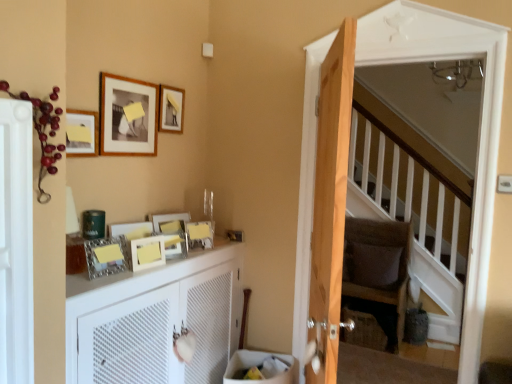
This screenshot has height=384, width=512. Describe the element at coordinates (330, 202) in the screenshot. I see `light brown wooden door at center` at that location.

From the picture: What is the approximate width of wooden photo frame at upper center, which is the first picture frame from top to bottom?

The width of wooden photo frame at upper center, which is the first picture frame from top to bottom, is 2.28 inches.

The image size is (512, 384). Describe the element at coordinates (480, 125) in the screenshot. I see `wooden screen door at right, the 2th screen door from the left` at that location.

What do you see at coordinates (104, 257) in the screenshot? I see `matte silver picture frame at center, the 2th picture frame in the bottom-to-top sequence` at bounding box center [104, 257].

This screenshot has width=512, height=384. Identify the location of light brown wooden door at center. (330, 202).

Where is `the 7th picture frame to the left of the dark brown fabric armchair at center, counting from the anchor's position`? The height and width of the screenshot is (384, 512). the 7th picture frame to the left of the dark brown fabric armchair at center, counting from the anchor's position is located at coordinates (104, 257).

From the image's perspective, which is below, dark brown fabric armchair at center or matte silver picture frame at center, the 2th picture frame in the bottom-to-top sequence?

From the image's view, dark brown fabric armchair at center is below.

Considering the relative positions of dark brown fabric armchair at center and matte silver picture frame at center, which ranks as the seventh picture frame in top-to-bottom order, in the image provided, is dark brown fabric armchair at center in front of matte silver picture frame at center, which ranks as the seventh picture frame in top-to-bottom order,?

No, dark brown fabric armchair at center is further to the viewer.

Is dark brown fabric armchair at center placed right next to matte silver picture frame at center, which ranks as the seventh picture frame in top-to-bottom order?

No, dark brown fabric armchair at center is not next to matte silver picture frame at center, which ranks as the seventh picture frame in top-to-bottom order.

Is metallic silver picture frame at upper center, the 4th picture frame when ordered from bottom to top, at the back of matte wooden picture frame at upper left, which appears as the 7th picture frame when ordered from the bottom?

No, matte wooden picture frame at upper left, which appears as the 7th picture frame when ordered from the bottom,'s orientation is not away from metallic silver picture frame at upper center, the 4th picture frame when ordered from bottom to top.

Is matte wooden picture frame at upper left, which appears as the 7th picture frame when ordered from the bottom, taller or shorter than metallic silver picture frame at upper center, which is the fifth picture frame from top to bottom?

Clearly, matte wooden picture frame at upper left, which appears as the 7th picture frame when ordered from the bottom, is taller compared to metallic silver picture frame at upper center, which is the fifth picture frame from top to bottom.

Considering the sizes of objects matte wooden picture frame at upper left, which appears as the 7th picture frame when ordered from the bottom, and metallic silver picture frame at upper center, the 4th picture frame when ordered from bottom to top, in the image provided, who is thinner, matte wooden picture frame at upper left, which appears as the 7th picture frame when ordered from the bottom, or metallic silver picture frame at upper center, the 4th picture frame when ordered from bottom to top,?

matte wooden picture frame at upper left, which appears as the 7th picture frame when ordered from the bottom.

From the image's perspective, between matte wooden picture frame at upper center, the 4th picture frame positioned from the top, and white matte cabinet at left, who is located below?

white matte cabinet at left appears lower in the image.

How many degrees apart are the facing directions of matte wooden picture frame at upper center, acting as the fifth picture frame starting from the bottom, and white matte cabinet at left?

The facing directions of matte wooden picture frame at upper center, acting as the fifth picture frame starting from the bottom, and white matte cabinet at left are 19.7 degrees apart.

From a real-world perspective, who is located lower, matte wooden picture frame at upper center, the 4th picture frame positioned from the top, or white matte cabinet at left?

In real-world perspective, white matte cabinet at left is lower.

Is wooden photo frame at upper center, which appears as the 8th picture frame when ordered from the bottom, taller than matte wooden picture frame at upper left, which appears as the 7th picture frame when ordered from the bottom?

Incorrect, the height of wooden photo frame at upper center, which appears as the 8th picture frame when ordered from the bottom, is not larger of that of matte wooden picture frame at upper left, which appears as the 7th picture frame when ordered from the bottom.

Could you tell me if wooden photo frame at upper center, which is the first picture frame from top to bottom, is facing matte wooden picture frame at upper left, the second picture frame from the top?

No, wooden photo frame at upper center, which is the first picture frame from top to bottom, is not aimed at matte wooden picture frame at upper left, the second picture frame from the top.

From the image's perspective, is wooden photo frame at upper center, which is the first picture frame from top to bottom, below matte wooden picture frame at upper left, which appears as the 7th picture frame when ordered from the bottom?

No, from the image's perspective, wooden photo frame at upper center, which is the first picture frame from top to bottom, is not below matte wooden picture frame at upper left, which appears as the 7th picture frame when ordered from the bottom.

Is brown woven basket at lower right taller than white matte radiator at left, which is the 1th screen door in front-to-back order?

In fact, brown woven basket at lower right may be shorter than white matte radiator at left, which is the 1th screen door in front-to-back order.

Looking at this image, is brown woven basket at lower right closer to camera compared to white matte radiator at left, acting as the first screen door starting from the left?

No.

From the image's perspective, is brown woven basket at lower right over white matte radiator at left, acting as the first screen door starting from the left?

No.

Which of these two, brown woven basket at lower right or white matte radiator at left, acting as the second screen door starting from the back, is wider?

brown woven basket at lower right is wider.

Does wooden screen door at right, which is the first screen door from right to left, touch matte silver picture frame at center, the 2th picture frame in the bottom-to-top sequence?

No, wooden screen door at right, which is the first screen door from right to left, is not next to matte silver picture frame at center, the 2th picture frame in the bottom-to-top sequence.

Which is farther from the camera, (462,376) or (105,251)?

Positioned behind is point (462,376).

Consider the image. How far apart are wooden screen door at right, placed as the first screen door when sorted from back to front, and matte silver picture frame at center, which ranks as the seventh picture frame in top-to-bottom order?

The distance of wooden screen door at right, placed as the first screen door when sorted from back to front, from matte silver picture frame at center, which ranks as the seventh picture frame in top-to-bottom order, is 1.38 meters.

Is wooden screen door at right, which is the first screen door from right to left, inside or outside of matte silver picture frame at center, which ranks as the seventh picture frame in top-to-bottom order?

wooden screen door at right, which is the first screen door from right to left, lies outside matte silver picture frame at center, which ranks as the seventh picture frame in top-to-bottom order.

Based on the photo, is wooden photo frame at upper center, which appears as the 8th picture frame when ordered from the bottom, to the left or to the right of matte wooden picture frame at upper center, acting as the fifth picture frame starting from the bottom, in the image?

Based on their positions, wooden photo frame at upper center, which appears as the 8th picture frame when ordered from the bottom, is located to the right of matte wooden picture frame at upper center, acting as the fifth picture frame starting from the bottom.

You are a GUI agent. You are given a task and a screenshot of the screen. Output one action in this format:
    pyautogui.click(x=<x>, y=<y>)
    Task: Click on the 3rd picture frame located above the matte wooden picture frame at upper center, acting as the fifth picture frame starting from the bottom (from a real-world perspective)
    The width and height of the screenshot is (512, 384).
    Given the screenshot: What is the action you would take?
    pyautogui.click(x=170, y=109)

From a real-world perspective, is wooden photo frame at upper center, which is the first picture frame from top to bottom, located higher than matte wooden picture frame at upper center, the 4th picture frame positioned from the top?

Yes, from a real-world perspective, wooden photo frame at upper center, which is the first picture frame from top to bottom, is on top of matte wooden picture frame at upper center, the 4th picture frame positioned from the top.

At what (x,y) coordinates should I click in order to perform the action: click on armchair on the right side of matte silver picture frame at center, the 2th picture frame in the bottom-to-top sequence. Please return your answer as a coordinate pair (x, y). The image size is (512, 384). Looking at the image, I should click on coord(378,272).

Where is `the 3rd picture frame positioned above the metallic silver picture frame at upper center, the 4th picture frame when ordered from bottom to top (from the image's perspective)`? This screenshot has height=384, width=512. the 3rd picture frame positioned above the metallic silver picture frame at upper center, the 4th picture frame when ordered from bottom to top (from the image's perspective) is located at coordinates (127, 116).

Looking at this image, from the image, which object appears to be nearer to brown woven basket at lower right, matte silver picture frame at center, which ranks as the seventh picture frame in top-to-bottom order, or brown fabric pillow at center?

brown fabric pillow at center is closer to brown woven basket at lower right.

When comparing their distances from matte plastic picture frame at upper center, the 3th picture frame from the bottom, does brown woven basket at lower right or matte wooden picture frame at upper left, the second picture frame from the top, seem closer?

matte wooden picture frame at upper left, the second picture frame from the top, is positioned closer to the anchor matte plastic picture frame at upper center, the 3th picture frame from the bottom.

When comparing their distances from brown woven basket at lower right, does wooden photo frame at upper center, which appears as the 8th picture frame when ordered from the bottom, or matte wooden picture frame at upper left, which appears as the 7th picture frame when ordered from the bottom, seem closer?

wooden photo frame at upper center, which appears as the 8th picture frame when ordered from the bottom, is closer to brown woven basket at lower right.

Estimate the real-world distances between objects in this image. Which object is closer to matte wooden picture frame at upper left, positioned as the 6th picture frame in bottom-to-top order, matte plastic picture frame at upper center, the 3th picture frame from the bottom, or wooden photo frame at upper center, which is the first picture frame from top to bottom?

wooden photo frame at upper center, which is the first picture frame from top to bottom, is closer to matte wooden picture frame at upper left, positioned as the 6th picture frame in bottom-to-top order.

Estimate the real-world distances between objects in this image. Which object is further from dark brown fabric armchair at center, brown fabric pillow at center or wooden photo frame at center, which appears as the first picture frame when ordered from the bottom?

wooden photo frame at center, which appears as the first picture frame when ordered from the bottom, lies further to dark brown fabric armchair at center than the other object.

Looking at this image, looking at the image, which one is located further to matte wooden picture frame at upper left, positioned as the 6th picture frame in bottom-to-top order, matte wooden picture frame at upper left, which appears as the 7th picture frame when ordered from the bottom, or light brown wooden door at center?

Among the two, light brown wooden door at center is located further to matte wooden picture frame at upper left, positioned as the 6th picture frame in bottom-to-top order.

From the image, which object appears to be nearer to matte wooden picture frame at upper left, which appears as the 7th picture frame when ordered from the bottom, wooden photo frame at upper center, which appears as the 8th picture frame when ordered from the bottom, or matte silver picture frame at center, the 2th picture frame in the bottom-to-top sequence?

Based on the image, wooden photo frame at upper center, which appears as the 8th picture frame when ordered from the bottom, appears to be nearer to matte wooden picture frame at upper left, which appears as the 7th picture frame when ordered from the bottom.

When comparing their distances from matte silver picture frame at center, which ranks as the seventh picture frame in top-to-bottom order, does wooden photo frame at center, which appears as the first picture frame when ordered from the bottom, or metallic silver picture frame at upper center, the 4th picture frame when ordered from bottom to top, seem further?

Based on the image, metallic silver picture frame at upper center, the 4th picture frame when ordered from bottom to top, appears to be further to matte silver picture frame at center, which ranks as the seventh picture frame in top-to-bottom order.

The image size is (512, 384). I want to click on cabinetry located between matte wooden picture frame at upper center, acting as the fifth picture frame starting from the bottom, and dark brown fabric armchair at center in the left-right direction, so click(156, 320).

Locate an element on the screen. This screenshot has height=384, width=512. cabinetry located between matte silver picture frame at center, the 2th picture frame in the bottom-to-top sequence, and light brown wooden door at center in the left-right direction is located at coordinates (156, 320).

This screenshot has width=512, height=384. Identify the location of screen door situated between metallic silver picture frame at upper center, which is the fifth picture frame from top to bottom, and brown woven basket at lower right from left to right. (480, 125).

In order to click on screen door between matte silver picture frame at center, the 2th picture frame in the bottom-to-top sequence, and brown woven basket at lower right from left to right in this screenshot , I will do `click(480, 125)`.